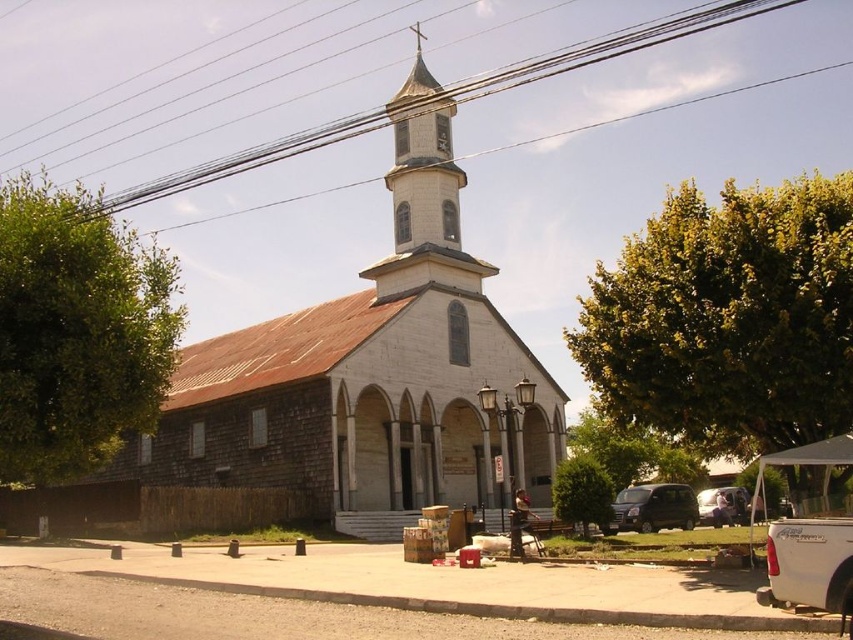
You are a photographer wanting to capture the white stone bell tower at upper center and the matte black van at lower right in the same frame. Based on their sizes in the image, which object will appear taller in the photo?

The white stone bell tower at upper center will appear taller in the photo since it has a greater height compared to the matte black van at lower right.

You are a photographer trying to capture the white wood church at center from the road. You notice the matte black van at lower right is blocking part of the church. Can you move the van to get a clear shot of the church?

The white wood church at center is positioned over the matte black van at lower right, so moving the matte black van at lower right would allow you to see the entire white wood church at center without obstruction.